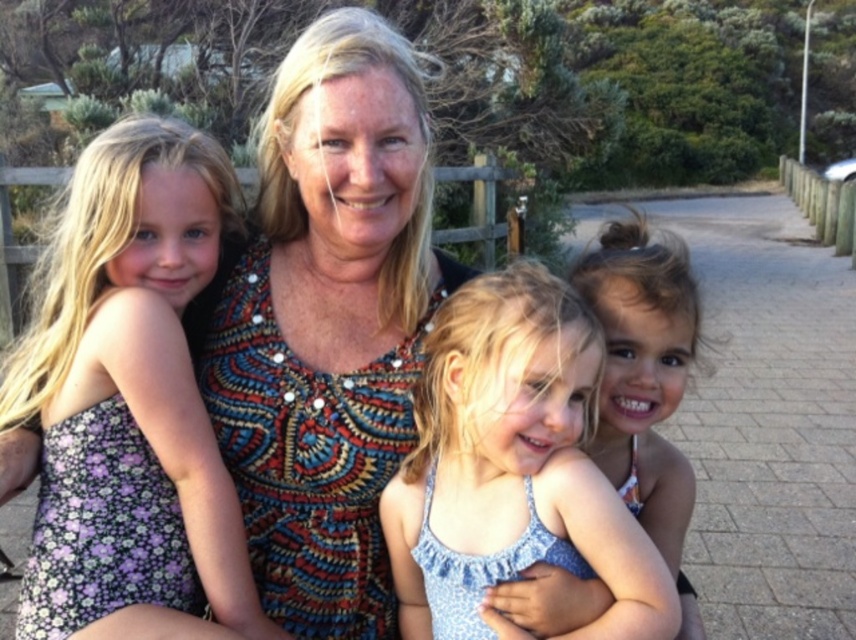
Does purple floral dress at left appear over blue fabric dress at center?

Yes.

Is point (238, 518) closer to camera compared to point (520, 388)?

No.

Find the location of `purple floral dress at left`. purple floral dress at left is located at coordinates (143, 346).

Can you confirm if multicolored beaded dress at center is shorter than blue fabric dress at center?

In fact, multicolored beaded dress at center may be taller than blue fabric dress at center.

I want to click on multicolored beaded dress at center, so click(328, 324).

Who is more distant from viewer, (259,148) or (649,577)?

Point (259,148)

At what (x,y) coordinates should I click in order to perform the action: click on multicolored beaded dress at center. Please return your answer as a coordinate pair (x, y). The height and width of the screenshot is (640, 856). Looking at the image, I should click on (328, 324).

Looking at this image, can you confirm if multicolored beaded dress at center is shorter than purple floral dress at left?

No, multicolored beaded dress at center is not shorter than purple floral dress at left.

Is multicolored beaded dress at center positioned behind purple floral dress at left?

Yes, multicolored beaded dress at center is behind purple floral dress at left.

Which is in front, point (331, 40) or point (149, 248)?

Positioned in front is point (331, 40).

Locate an element on the screen. The height and width of the screenshot is (640, 856). multicolored beaded dress at center is located at coordinates coord(328,324).